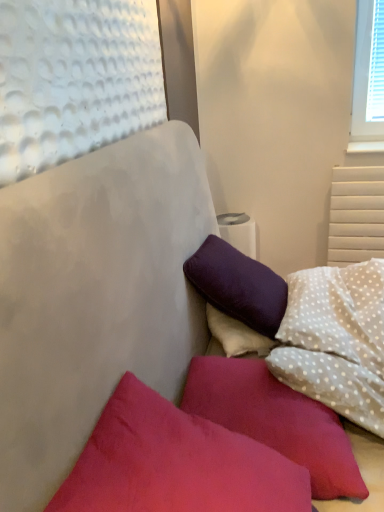
Describe the element at coordinates (175, 463) in the screenshot. I see `suede-like red pillow at lower center, which is the 3th pillow from back to front` at that location.

What is the approximate width of white dotted fabric pillow at upper right, marked as the 3th pillow in a front-to-back arrangement?

white dotted fabric pillow at upper right, marked as the 3th pillow in a front-to-back arrangement, is 15.44 inches wide.

Identify the location of matte pink pillow at lower left, which is the 2th pillow in back-to-front order. (275, 420).

Who is shorter, white dotted fabric pillow at upper right, which is counted as the 1th pillow, starting from the back, or matte pink pillow at lower left, which is the 2th pillow in back-to-front order?

Standing shorter between the two is matte pink pillow at lower left, which is the 2th pillow in back-to-front order.

Which of these two, white dotted fabric pillow at upper right, marked as the 3th pillow in a front-to-back arrangement, or matte pink pillow at lower left, which is the 2th pillow in back-to-front order, is smaller?

matte pink pillow at lower left, which is the 2th pillow in back-to-front order.

Based on the photo, between white dotted fabric pillow at upper right, marked as the 3th pillow in a front-to-back arrangement, and matte pink pillow at lower left, which is the 2th pillow in back-to-front order, which one appears on the right side from the viewer's perspective?

From the viewer's perspective, white dotted fabric pillow at upper right, marked as the 3th pillow in a front-to-back arrangement, appears more on the right side.

From the image's perspective, is suede-like red pillow at lower center, which is the 3th pillow from back to front, under matte pink pillow at lower left, the 2th pillow positioned from the front?

No, from the image's perspective, suede-like red pillow at lower center, which is the 3th pillow from back to front, is not below matte pink pillow at lower left, the 2th pillow positioned from the front.

Can you see suede-like red pillow at lower center, marked as the first pillow in a front-to-back arrangement, touching matte pink pillow at lower left, which is the 2th pillow in back-to-front order?

No, suede-like red pillow at lower center, marked as the first pillow in a front-to-back arrangement, is not next to matte pink pillow at lower left, which is the 2th pillow in back-to-front order.

Considering the sizes of objects suede-like red pillow at lower center, marked as the first pillow in a front-to-back arrangement, and matte pink pillow at lower left, the 2th pillow positioned from the front, in the image provided, who is bigger, suede-like red pillow at lower center, marked as the first pillow in a front-to-back arrangement, or matte pink pillow at lower left, the 2th pillow positioned from the front,?

With larger size is suede-like red pillow at lower center, marked as the first pillow in a front-to-back arrangement.

Choose the correct answer: Is suede-like red pillow at lower center, which is the 3th pillow from back to front, inside matte pink pillow at lower left, which is the 2th pillow in back-to-front order, or outside it?

suede-like red pillow at lower center, which is the 3th pillow from back to front, cannot be found inside matte pink pillow at lower left, which is the 2th pillow in back-to-front order.

Measure the distance from matte pink pillow at lower left, the 2th pillow positioned from the front, to suede-like red pillow at lower center, marked as the first pillow in a front-to-back arrangement.

matte pink pillow at lower left, the 2th pillow positioned from the front, is 9.59 inches away from suede-like red pillow at lower center, marked as the first pillow in a front-to-back arrangement.

From a real-world perspective, starting from the matte pink pillow at lower left, the 2th pillow positioned from the front, which pillow is the 2nd one vertically above it? Please provide its 2D coordinates.

[(175, 463)]

Which point is more forward, [220,403] or [92,499]?

The point [92,499] is closer to the camera.

Measure the distance between suede-like red pillow at lower center, marked as the first pillow in a front-to-back arrangement, and white dotted fabric pillow at upper right, marked as the 3th pillow in a front-to-back arrangement.

They are 23.33 inches apart.

Does suede-like red pillow at lower center, which is the 3th pillow from back to front, have a lesser width compared to white dotted fabric pillow at upper right, marked as the 3th pillow in a front-to-back arrangement?

No.

Considering the sizes of objects suede-like red pillow at lower center, which is the 3th pillow from back to front, and white dotted fabric pillow at upper right, marked as the 3th pillow in a front-to-back arrangement, in the image provided, who is smaller, suede-like red pillow at lower center, which is the 3th pillow from back to front, or white dotted fabric pillow at upper right, marked as the 3th pillow in a front-to-back arrangement,?

suede-like red pillow at lower center, which is the 3th pillow from back to front.

From a real-world perspective, which is physically above, suede-like red pillow at lower center, marked as the first pillow in a front-to-back arrangement, or white dotted fabric pillow at upper right, which is counted as the 1th pillow, starting from the back?

From a 3D spatial view, suede-like red pillow at lower center, marked as the first pillow in a front-to-back arrangement, is above.

What's the angular difference between matte pink pillow at lower left, the 2th pillow positioned from the front, and white dotted fabric pillow at upper right, marked as the 3th pillow in a front-to-back arrangement,'s facing directions?

0.921 degrees.

Between matte pink pillow at lower left, the 2th pillow positioned from the front, and white dotted fabric pillow at upper right, marked as the 3th pillow in a front-to-back arrangement, which one is positioned in front?

Positioned in front is matte pink pillow at lower left, the 2th pillow positioned from the front.

Is matte pink pillow at lower left, the 2th pillow positioned from the front, to the left or to the right of white dotted fabric pillow at upper right, marked as the 3th pillow in a front-to-back arrangement, in the image?

Based on their positions, matte pink pillow at lower left, the 2th pillow positioned from the front, is located to the left of white dotted fabric pillow at upper right, marked as the 3th pillow in a front-to-back arrangement.

Does matte pink pillow at lower left, the 2th pillow positioned from the front, have a larger size compared to white dotted fabric pillow at upper right, which is counted as the 1th pillow, starting from the back?

No, matte pink pillow at lower left, the 2th pillow positioned from the front, is not bigger than white dotted fabric pillow at upper right, which is counted as the 1th pillow, starting from the back.

Considering the relative positions of white dotted fabric pillow at upper right, marked as the 3th pillow in a front-to-back arrangement, and suede-like red pillow at lower center, which is the 3th pillow from back to front, in the image provided, is white dotted fabric pillow at upper right, marked as the 3th pillow in a front-to-back arrangement, to the left of suede-like red pillow at lower center, which is the 3th pillow from back to front, from the viewer's perspective?

In fact, white dotted fabric pillow at upper right, marked as the 3th pillow in a front-to-back arrangement, is to the right of suede-like red pillow at lower center, which is the 3th pillow from back to front.

Would you say white dotted fabric pillow at upper right, which is counted as the 1th pillow, starting from the back, contains suede-like red pillow at lower center, marked as the first pillow in a front-to-back arrangement?

No, suede-like red pillow at lower center, marked as the first pillow in a front-to-back arrangement, is not a part of white dotted fabric pillow at upper right, which is counted as the 1th pillow, starting from the back.

From the image's perspective, is white dotted fabric pillow at upper right, marked as the 3th pillow in a front-to-back arrangement, on suede-like red pillow at lower center, which is the 3th pillow from back to front?

Yes, from the image's perspective, white dotted fabric pillow at upper right, marked as the 3th pillow in a front-to-back arrangement, is on top of suede-like red pillow at lower center, which is the 3th pillow from back to front.

Find the location of `pillow to the right of matte pink pillow at lower left, which is the 2th pillow in back-to-front order`. pillow to the right of matte pink pillow at lower left, which is the 2th pillow in back-to-front order is located at coordinates (338, 312).

Locate an element on the screen. pillow in front of the matte pink pillow at lower left, which is the 2th pillow in back-to-front order is located at coordinates (175, 463).

Based on the photo, looking at the image, which one is located closer to white dotted fabric pillow at upper right, which is counted as the 1th pillow, starting from the back, suede-like red pillow at lower center, marked as the first pillow in a front-to-back arrangement, or matte pink pillow at lower left, the 2th pillow positioned from the front?

The object closer to white dotted fabric pillow at upper right, which is counted as the 1th pillow, starting from the back, is matte pink pillow at lower left, the 2th pillow positioned from the front.

Considering their positions, is matte pink pillow at lower left, the 2th pillow positioned from the front, positioned closer to suede-like red pillow at lower center, marked as the first pillow in a front-to-back arrangement, than white dotted fabric pillow at upper right, which is counted as the 1th pillow, starting from the back?

The object closer to suede-like red pillow at lower center, marked as the first pillow in a front-to-back arrangement, is matte pink pillow at lower left, the 2th pillow positioned from the front.

From the image, which object appears to be nearer to suede-like red pillow at lower center, marked as the first pillow in a front-to-back arrangement, white dotted fabric pillow at upper right, marked as the 3th pillow in a front-to-back arrangement, or matte pink pillow at lower left, which is the 2th pillow in back-to-front order?

Based on the image, matte pink pillow at lower left, which is the 2th pillow in back-to-front order, appears to be nearer to suede-like red pillow at lower center, marked as the first pillow in a front-to-back arrangement.

Which object lies further to the anchor point matte pink pillow at lower left, the 2th pillow positioned from the front, white dotted fabric pillow at upper right, which is counted as the 1th pillow, starting from the back, or suede-like red pillow at lower center, which is the 3th pillow from back to front?

Based on the image, white dotted fabric pillow at upper right, which is counted as the 1th pillow, starting from the back, appears to be further to matte pink pillow at lower left, the 2th pillow positioned from the front.

Estimate the real-world distances between objects in this image. Which object is closer to matte pink pillow at lower left, the 2th pillow positioned from the front, suede-like red pillow at lower center, marked as the first pillow in a front-to-back arrangement, or white dotted fabric pillow at upper right, marked as the 3th pillow in a front-to-back arrangement?

suede-like red pillow at lower center, marked as the first pillow in a front-to-back arrangement, is positioned closer to the anchor matte pink pillow at lower left, the 2th pillow positioned from the front.

Estimate the real-world distances between objects in this image. Which object is further from white dotted fabric pillow at upper right, which is counted as the 1th pillow, starting from the back, matte pink pillow at lower left, which is the 2th pillow in back-to-front order, or suede-like red pillow at lower center, marked as the first pillow in a front-to-back arrangement?

suede-like red pillow at lower center, marked as the first pillow in a front-to-back arrangement, is further to white dotted fabric pillow at upper right, which is counted as the 1th pillow, starting from the back.

At what (x,y) coordinates should I click in order to perform the action: click on pillow located between suede-like red pillow at lower center, marked as the first pillow in a front-to-back arrangement, and white dotted fabric pillow at upper right, marked as the 3th pillow in a front-to-back arrangement, in the depth direction. Please return your answer as a coordinate pair (x, y). The width and height of the screenshot is (384, 512). Looking at the image, I should click on (275, 420).